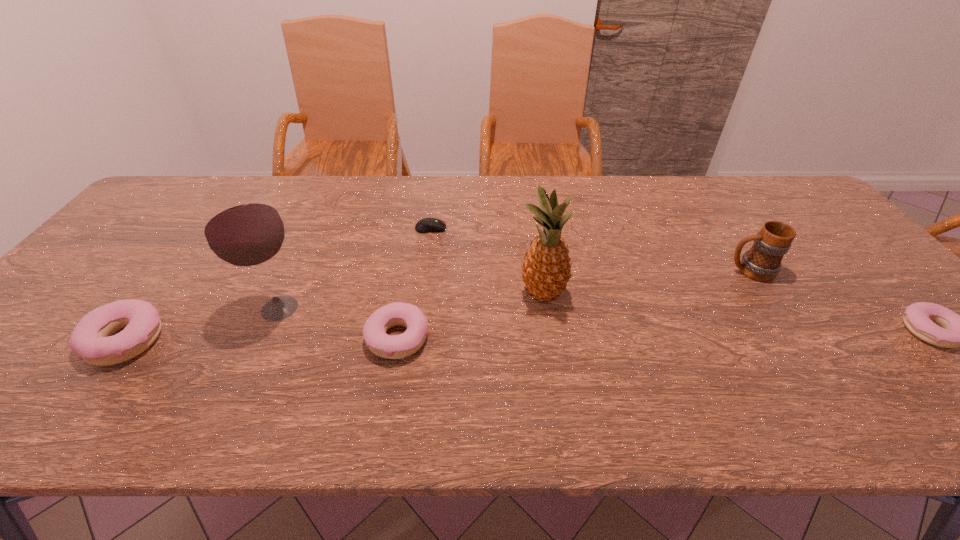
Identify the location of free spot located 0.090m on the back of the fifth tallest object. (406, 287).

Identify the location of vacant area situated 0.160m on the button of the farthest object. The height and width of the screenshot is (540, 960). (500, 228).

Image resolution: width=960 pixels, height=540 pixels. Find the location of `free space located 0.140m on the right of the pineapple`. free space located 0.140m on the right of the pineapple is located at coordinates (623, 294).

I want to click on free space located on the side of the sixth object from left to right with the handle, so click(691, 271).

This screenshot has width=960, height=540. Find the location of `vacant region located 0.150m on the side of the sixth object from left to right with the handle`. vacant region located 0.150m on the side of the sixth object from left to right with the handle is located at coordinates (669, 271).

You are a GUI agent. You are given a task and a screenshot of the screen. Output one action in this format:
    pyautogui.click(x=<x>, y=<y>)
    Task: Click on the free space located 0.190m on the side of the sixth object from left to right with the handle
    
    Given the screenshot: What is the action you would take?
    pyautogui.click(x=654, y=271)

I want to click on free location located on the back of the second object from left to right, so click(x=300, y=263).

Identify the location of object that is positioned at the left edge. This screenshot has height=540, width=960. (90, 339).

This screenshot has width=960, height=540. I want to click on object that is at the near left corner, so click(x=90, y=339).

The width and height of the screenshot is (960, 540). In the image, there is a desktop. Identify the location of vacant space at the far edge. (708, 214).